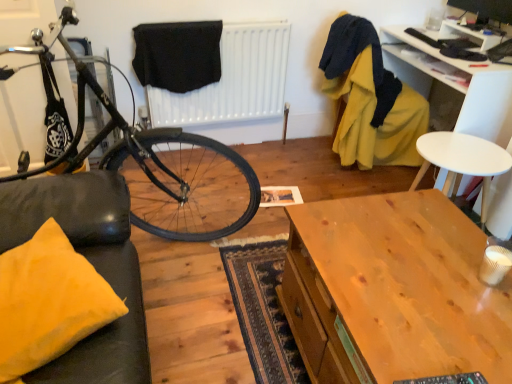
Question: In terms of height, does white plastic chair at upper right, which is counted as the second desk, starting from the bottom, look taller or shorter compared to black fabric at upper center?

Choices:
 (A) tall
 (B) short

Answer: (A)

Question: Is point (480, 132) closer or farther from the camera than point (225, 99)?

Choices:
 (A) farther
 (B) closer

Answer: (B)

Question: Which is farther from the wooden desk at center, which appears as the 2th desk when viewed from the back?

Choices:
 (A) yellow fabric pillow at lower left
 (B) shiny black bicycle at left
 (C) yellow fabric armchair at upper right
 (D) black fabric at center
 (E) black fabric at upper center

Answer: (E)

Question: Based on their relative distances, which object is nearer to the shiny black bicycle at left?

Choices:
 (A) yellow fabric armchair at upper right
 (B) wooden desk at center, which appears as the 2th desk when viewed from the back
 (C) white plastic chair at upper right, which is the 2th desk from front to back
 (D) black fabric at upper center
 (E) yellow fabric pillow at lower left

Answer: (D)